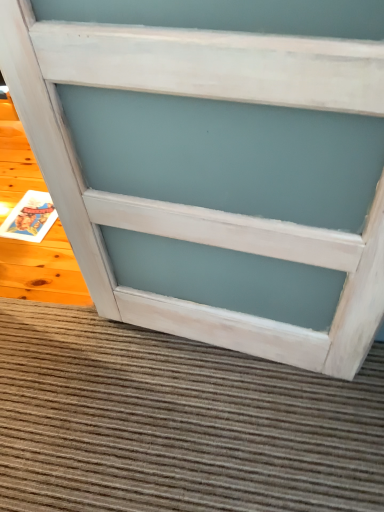
Locate an element on the screen. The image size is (384, 512). free space in front of white painted wood cabinet at lower center is located at coordinates (226, 433).